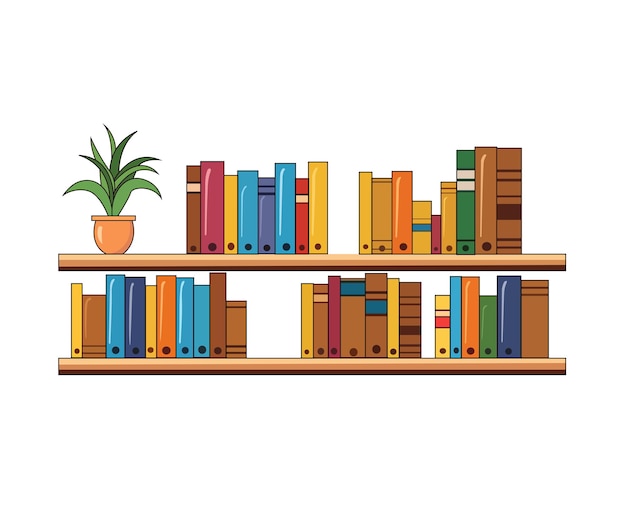
In order to click on light blue books in this screenshot , I will do [x=247, y=211], [x=287, y=209], [x=454, y=326], [x=200, y=323], [x=185, y=309], [x=114, y=325].